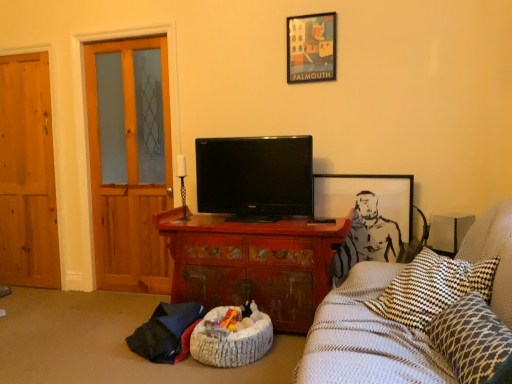
Question: Considering the positions of wooden door at left, which ranks as the 2th door in left-to-right order, and white textured blanket at right in the image, is wooden door at left, which ranks as the 2th door in left-to-right order, wider or thinner than white textured blanket at right?

Choices:
 (A) thin
 (B) wide

Answer: (A)

Question: Is wooden door at left, which ranks as the 2th door in left-to-right order, inside or outside of white textured blanket at right?

Choices:
 (A) inside
 (B) outside

Answer: (B)

Question: Based on their relative distances, which object is nearer to the leopard print cushion at lower right?

Choices:
 (A) distressed wood cabinet at center
 (B) wooden door at left, the second door viewed from the right
 (C) black glossy tv at center
 (D) wooden door at left, which ranks as the 2th door in left-to-right order
 (E) gray paper picture frame at upper right, the second picture frame when ordered from top to bottom

Answer: (A)

Question: Which is farther from the white textured infant bed at lower center?

Choices:
 (A) white textured blanket at right
 (B) wooden door at left, the second door viewed from the right
 (C) wooden door at left, which ranks as the 2th door in left-to-right order
 (D) distressed wood cabinet at center
 (E) black glossy tv at center

Answer: (B)